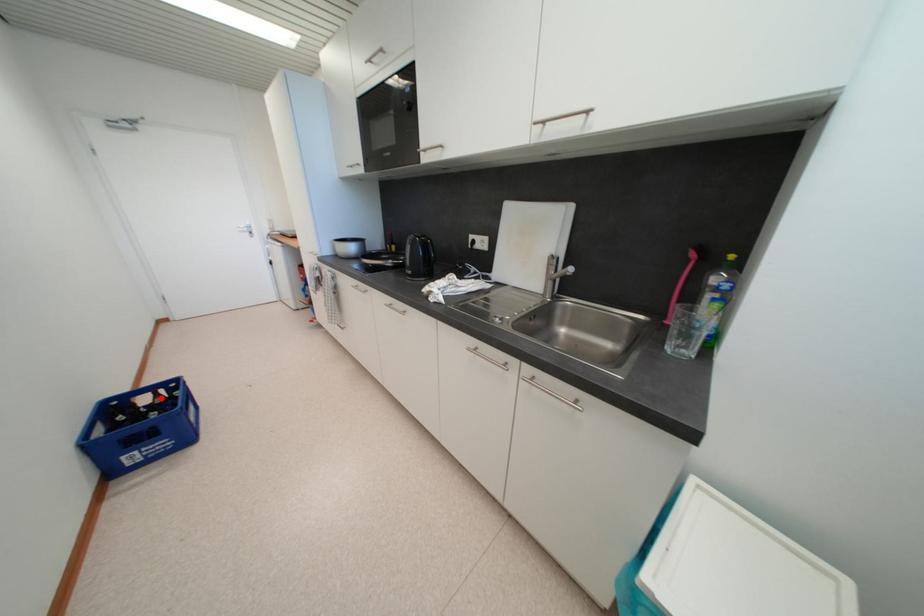
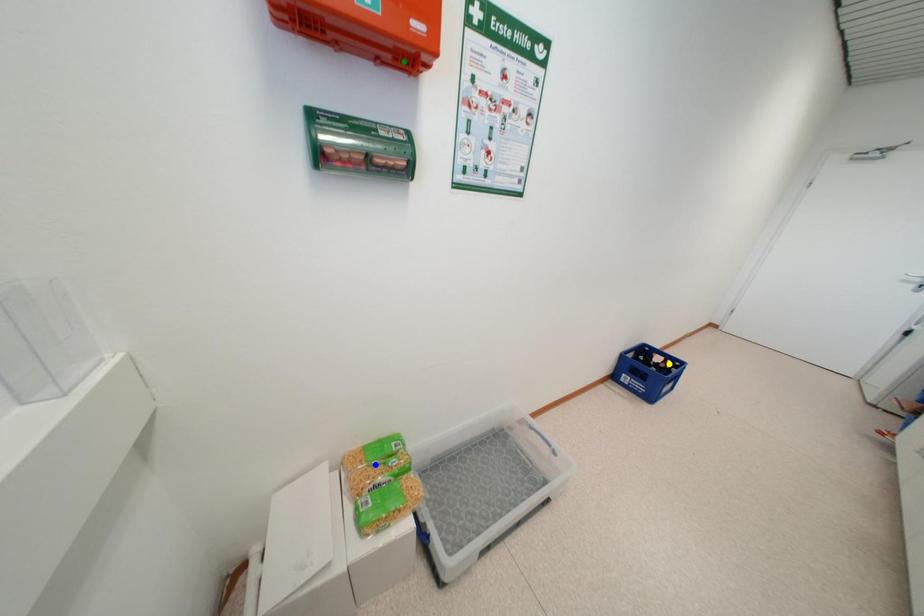
Question: I am providing you with two images of the same scene from different viewpoints. A red point is marked on the first image. You are given multiple points on the second image. Which point in image 2 is actually the same real-world point as the red point in image 1?

Choices:
 (A) yellow point
 (B) green point
 (C) blue point

Answer: (A)